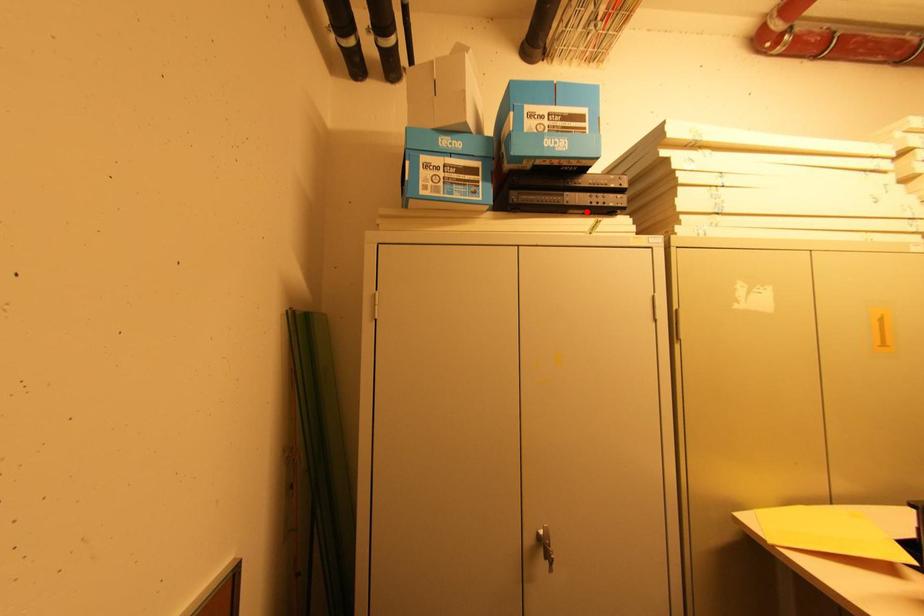
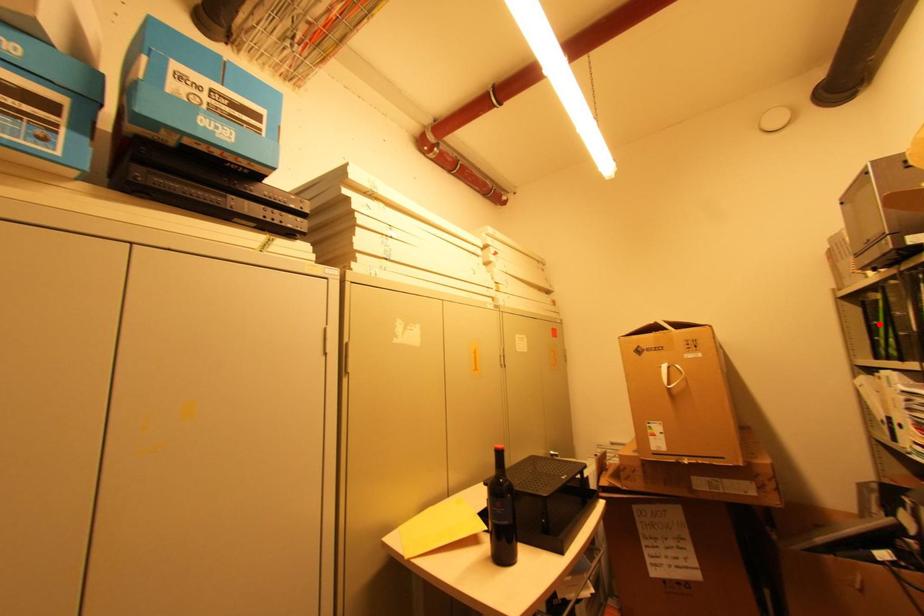
I am providing you with two images of the same scene from different viewpoints. A red point is marked on the first image and another point is marked on the second image. Does the point marked in image1 correspond to the same location as the one in image2?

No